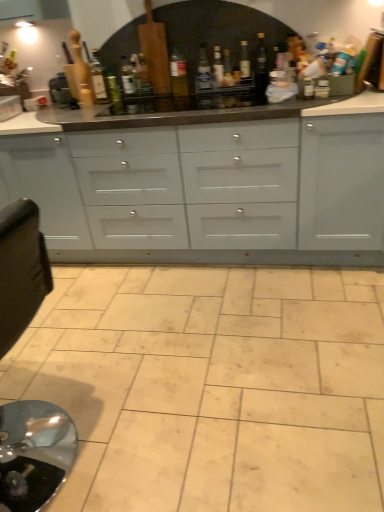
At what (x,y) coordinates should I click in order to perform the action: click on vacant space situated above beige ceramic tile at lower center (from a real-world perspective). Please return your answer as a coordinate pair (x, y). The width and height of the screenshot is (384, 512). Looking at the image, I should click on (194, 352).